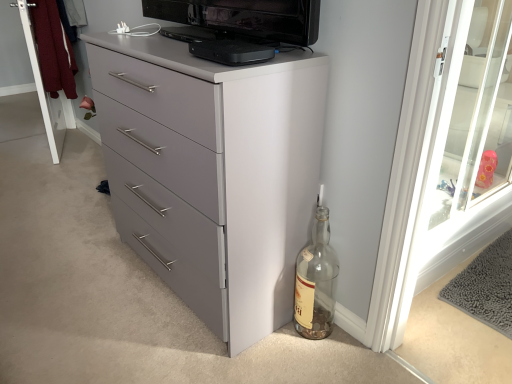
Question: Is point (202, 316) positioned closer to the camera than point (331, 316)?

Choices:
 (A) farther
 (B) closer

Answer: (B)

Question: Is matte gray chest of drawers at center spatially inside clear glass bottle at lower right, or outside of it?

Choices:
 (A) outside
 (B) inside

Answer: (A)

Question: Estimate the real-world distances between objects in this image. Which object is closer to the clear glass bottle at lower right?

Choices:
 (A) white wood screen door at upper left, which is counted as the second screen door, starting from the right
 (B) transparent glass screen door at upper right, which is counted as the 1th screen door, starting from the front
 (C) matte gray chest of drawers at center
 (D) black plastic device at upper center

Answer: (C)

Question: Which object is positioned farthest from the clear glass bottle at lower right?

Choices:
 (A) white wood screen door at upper left, the first screen door positioned from the back
 (B) transparent glass screen door at upper right, which is the 2th screen door in left-to-right order
 (C) matte gray chest of drawers at center
 (D) black plastic device at upper center

Answer: (A)